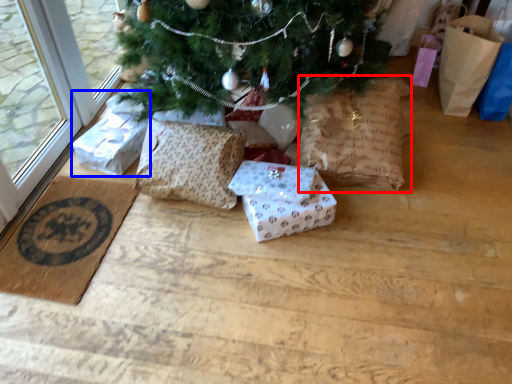
Question: Which point is closer to the camera, shopping bag (highlighted by a red box) or gift box (highlighted by a blue box)?

Choices:
 (A) shopping bag
 (B) gift box

Answer: (A)